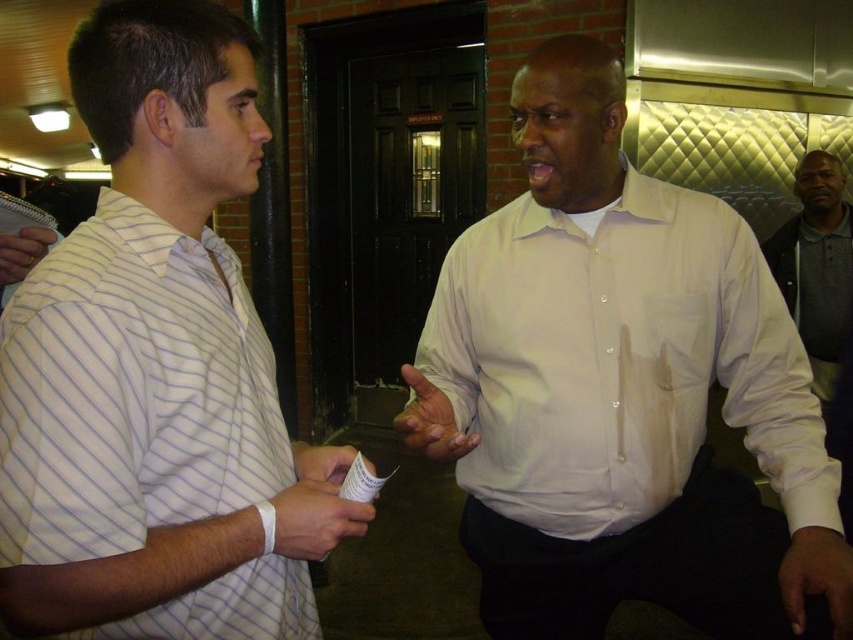
Which is in front, point (509, 632) or point (834, 358)?

Positioned in front is point (509, 632).

Does white smooth shirt at center come in front of dark gray polo shirt at right?

Yes, it is in front of dark gray polo shirt at right.

The width and height of the screenshot is (853, 640). I want to click on white smooth shirt at center, so click(x=622, y=392).

Is white smooth shirt at center further to camera compared to white striped shirt at left?

Yes, white smooth shirt at center is behind white striped shirt at left.

Who is more forward, (560, 589) or (80, 54)?

Point (80, 54)

Find the location of a particular element. The width and height of the screenshot is (853, 640). white smooth shirt at center is located at coordinates (622, 392).

Is white striped shirt at left wider than dark gray polo shirt at right?

Indeed, white striped shirt at left has a greater width compared to dark gray polo shirt at right.

Who is lower down, white striped shirt at left or dark gray polo shirt at right?

Positioned lower is white striped shirt at left.

Where is `white striped shirt at left`? white striped shirt at left is located at coordinates (157, 369).